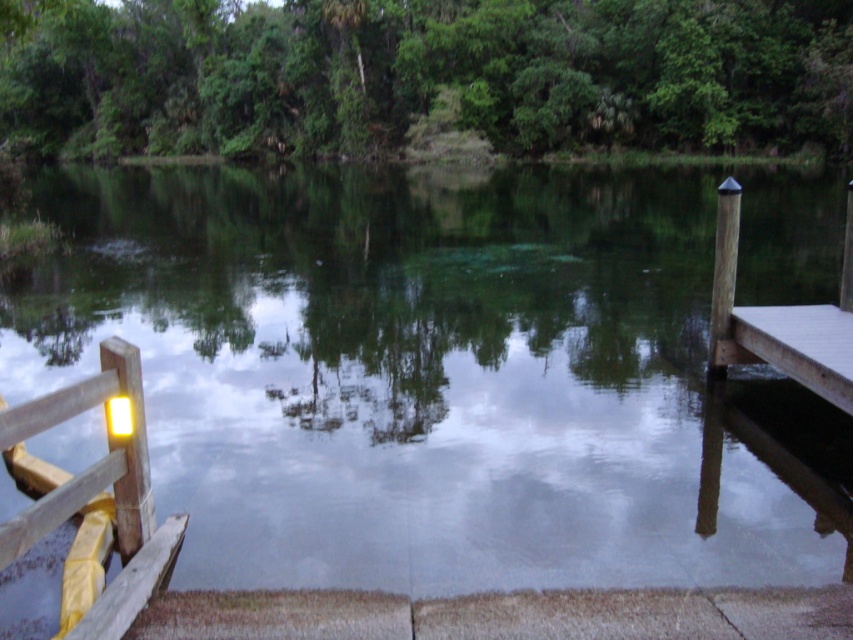
You are standing on the dock and want to take a photo of the green leafy tree at upper center. If your camera has a zoom lens that can focus precisely on a specific point, what coordinates should you aim for to capture the tree perfectly?

The green leafy tree at upper center is located at coordinates 0.117 on the x axis and 0.497 on the y axis, so you should aim your camera at point (422, 74) to capture it precisely.

You are a park ranger standing at the yellow painted wood at left on the dock. You need to reach the green leafy tree at upper center to check for signs of disease. Given that your walkie talkie has a range of 300 feet, will you be able to communicate with your team while moving towards the tree?

The green leafy tree at upper center is 143.70 feet from the yellow painted wood at left. Since the walkie talkie has a 300 feet range, you will remain within communication range while moving towards the tree.

You are standing on the dock and want to walk towards the two points marked in the image. Which point, point (149, 561) or point (759, 346), will you reach first?

You will reach point (149, 561) first because it is closer to you than point (759, 346).